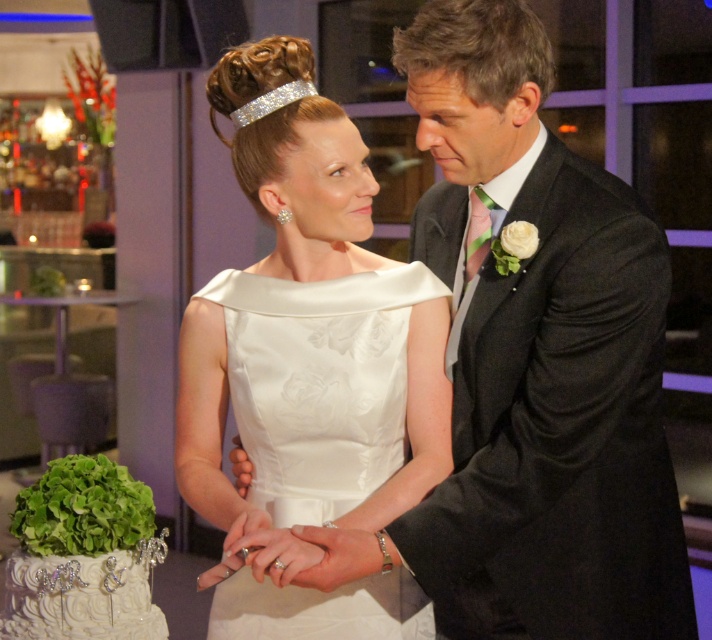
Question: Is black textured suit at center bigger than white textured cake at lower left?

Choices:
 (A) yes
 (B) no

Answer: (A)

Question: Which of the following is the farthest from the observer?

Choices:
 (A) (553, 387)
 (B) (436, 456)
 (C) (157, 540)

Answer: (C)

Question: Which point is farther from the camera taking this photo?

Choices:
 (A) (409, 513)
 (B) (73, 604)
 (C) (282, 451)

Answer: (B)

Question: In this image, where is satin dress at center located relative to white textured cake at lower left?

Choices:
 (A) left
 (B) right

Answer: (B)

Question: Which of the following is the closest to the observer?

Choices:
 (A) [x=214, y=324]
 (B) [x=523, y=488]
 (C) [x=28, y=604]

Answer: (B)

Question: Is satin dress at center below white textured cake at lower left?

Choices:
 (A) yes
 (B) no

Answer: (B)